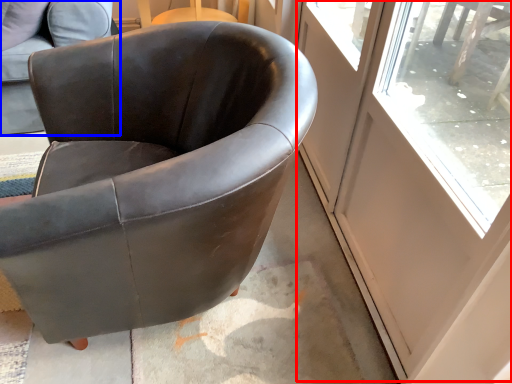
Question: Which of the following is the farthest to the observer, screen door (highlighted by a red box) or chair (highlighted by a blue box)?

Choices:
 (A) screen door
 (B) chair

Answer: (B)